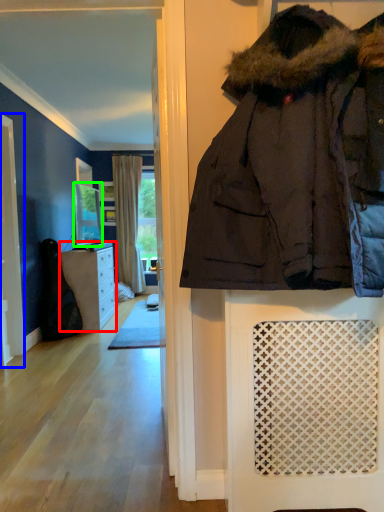
Question: Estimate the real-world distances between objects in this image. Which object is farther from cabinetry (highlighted by a red box), screen door (highlighted by a blue box) or mirror (highlighted by a green box)?

Choices:
 (A) screen door
 (B) mirror

Answer: (A)